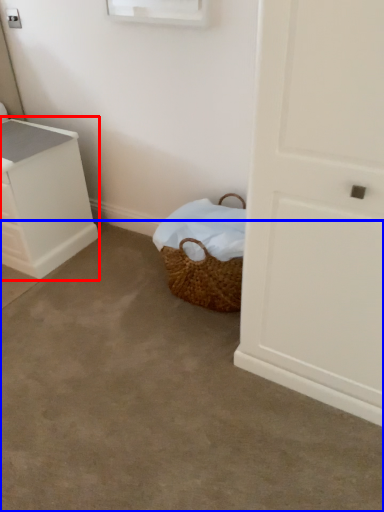
Question: Which point is closer to the camera, chest of drawers (highlighted by a red box) or concrete (highlighted by a blue box)?

Choices:
 (A) chest of drawers
 (B) concrete

Answer: (B)